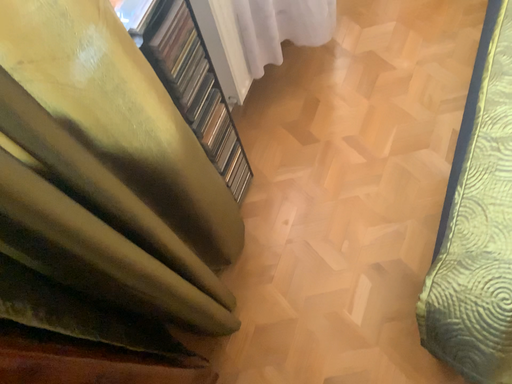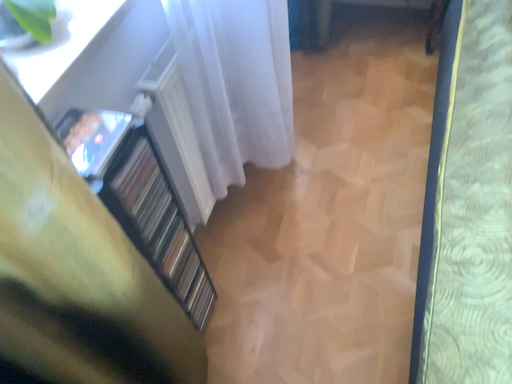
Question: Which way did the camera rotate in the video?

Choices:
 (A) rotated downward
 (B) rotated upward

Answer: (B)